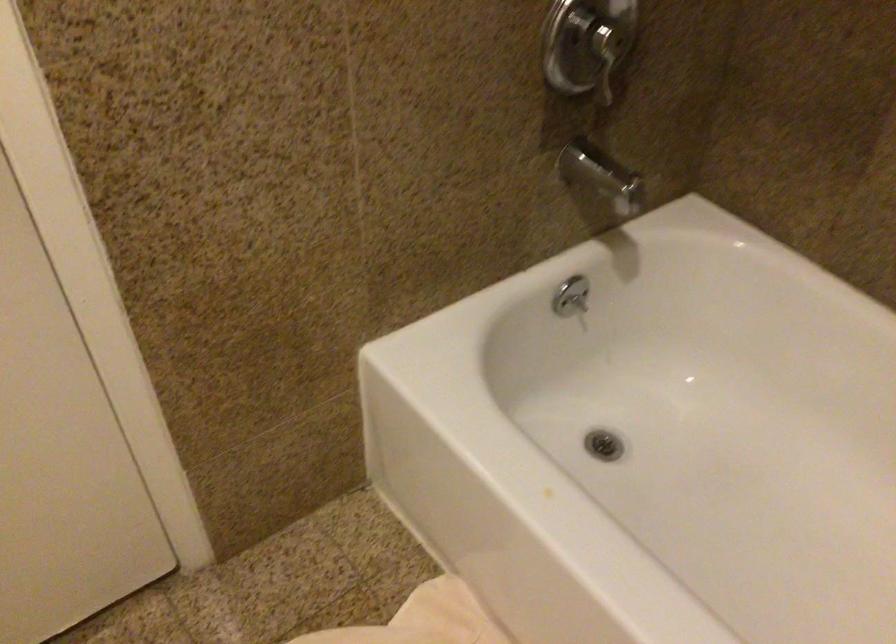
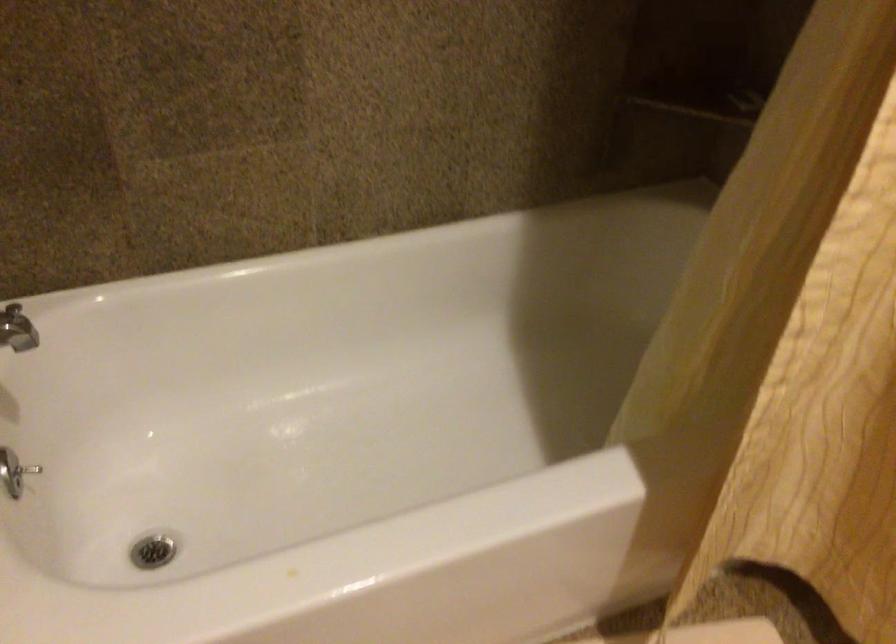
The first image is from the beginning of the video and the second image is from the end. How did the camera likely rotate when shooting the video?

The camera's rotation is toward right-down.